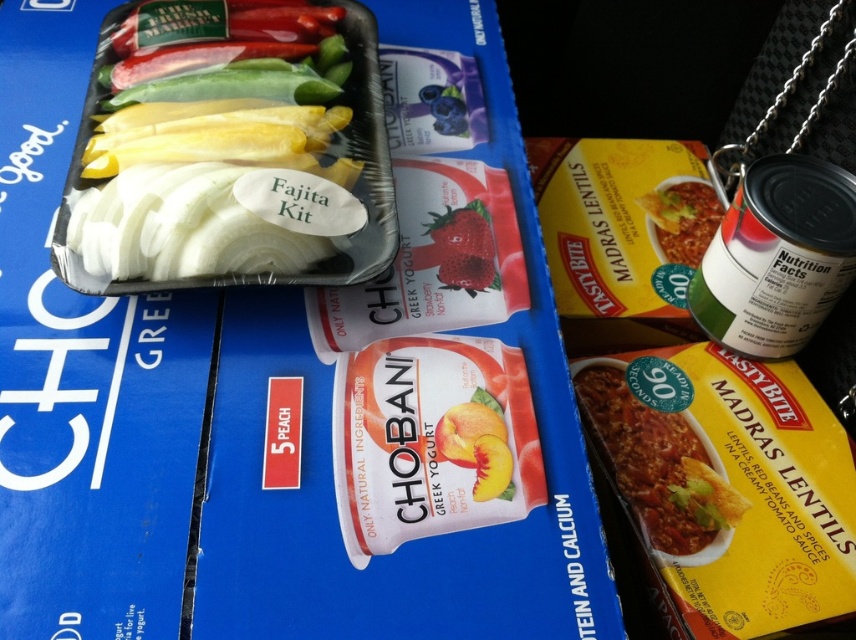
Question: Is strawberry matte at center below tomato sauce can at center?

Choices:
 (A) yes
 (B) no

Answer: (A)

Question: Does green matte can at upper right have a lesser width compared to yellow matte lentils at lower right?

Choices:
 (A) no
 (B) yes

Answer: (A)

Question: Which point is farther to the camera?

Choices:
 (A) (703, 484)
 (B) (831, 244)
 (C) (485, 227)

Answer: (C)

Question: Which point is farther from the camera taking this photo?

Choices:
 (A) (795, 300)
 (B) (657, 240)
 (C) (648, 465)
 (D) (483, 288)

Answer: (B)

Question: Is yellow matte lentils at lower right wider than strawberry matte at center?

Choices:
 (A) yes
 (B) no

Answer: (A)

Question: Which object is the farthest from the tomato sauce can at center?

Choices:
 (A) clear plastic fajita kit at upper left
 (B) yellow matte lentils at lower right
 (C) green matte can at upper right

Answer: (A)